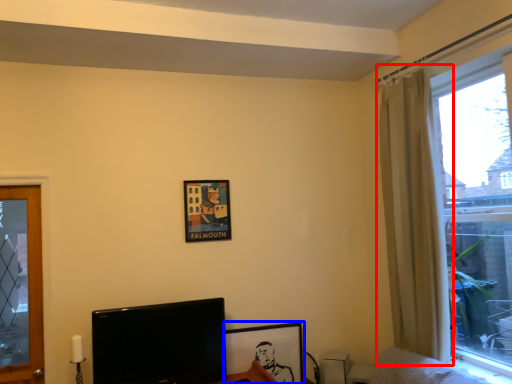
Question: Among these objects, which one is nearest to the camera, curtain (highlighted by a red box) or picture frame (highlighted by a blue box)?

Choices:
 (A) curtain
 (B) picture frame

Answer: (A)